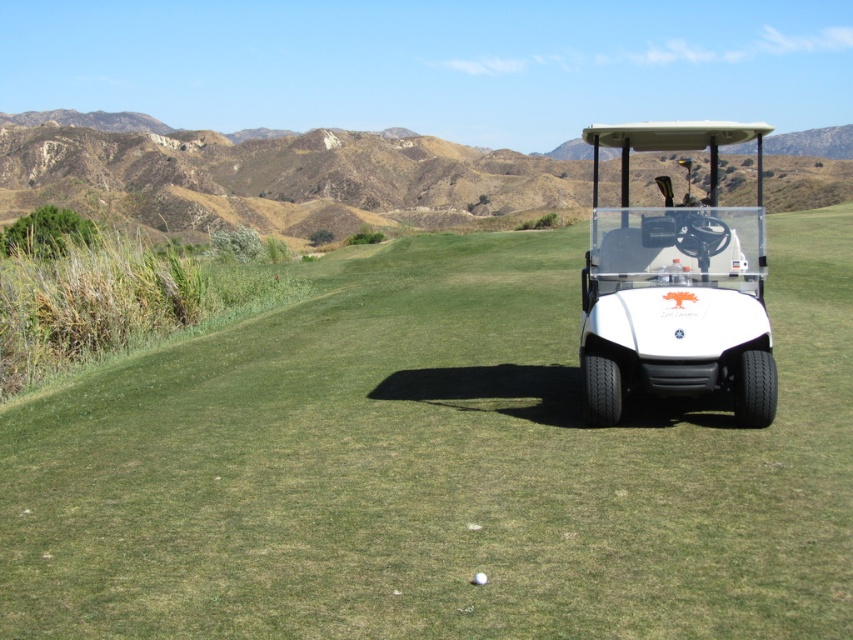
Can you confirm if green grassy hill at upper center is bigger than white matte golf ball at center?

Yes.

Does point (329, 150) lie in front of point (480, 582)?

No, it is behind (480, 582).

Looking at this image, measure the distance between point (360, 198) and camera.

74.54 meters

Locate an element on the screen. This screenshot has width=853, height=640. green grassy hill at upper center is located at coordinates (271, 176).

Looking at this image, does green grassy hill at upper center have a lesser height compared to white matte golf cart at center?

No, green grassy hill at upper center is not shorter than white matte golf cart at center.

Is green grassy hill at upper center wider than white matte golf cart at center?

Yes.

Between point (143, 168) and point (679, 342), which one is positioned behind?

Positioned behind is point (143, 168).

Identify the location of green grassy hill at upper center. The width and height of the screenshot is (853, 640). 271,176.

What are the coordinates of `white matte golf cart at center` in the screenshot? It's located at (675, 285).

Is white matte golf cart at center positioned before white matte golf ball at center?

No, it is behind white matte golf ball at center.

The height and width of the screenshot is (640, 853). I want to click on white matte golf cart at center, so click(x=675, y=285).

Locate an element on the screen. The height and width of the screenshot is (640, 853). white matte golf cart at center is located at coordinates (675, 285).